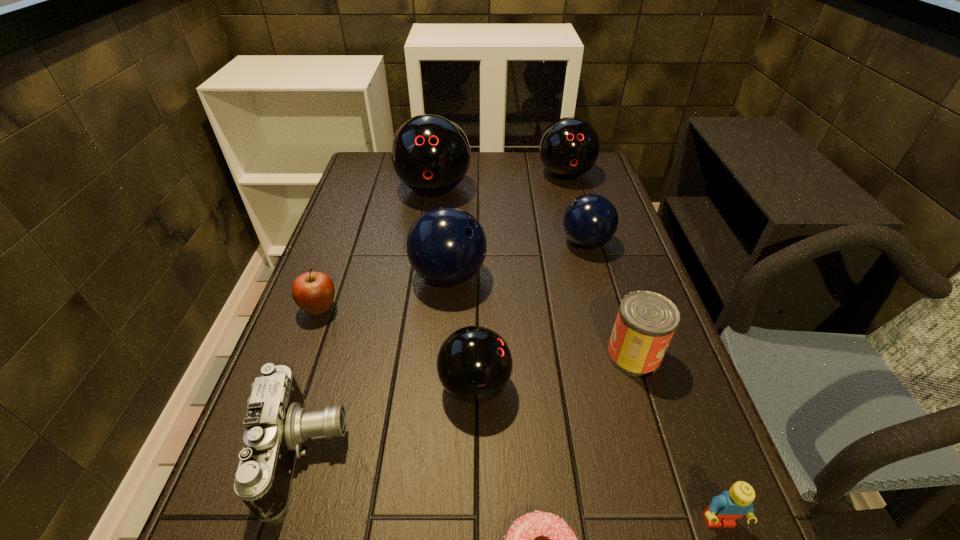
Locate an element on the screen. This screenshot has width=960, height=540. the tallest bowling ball is located at coordinates (430, 153).

This screenshot has width=960, height=540. I want to click on the tallest object, so click(x=430, y=153).

Where is `the rightmost black bowling ball`? This screenshot has width=960, height=540. the rightmost black bowling ball is located at coordinates (569, 147).

You are a GUI agent. You are given a task and a screenshot of the screen. Output one action in this format:
    pyautogui.click(x=<x>, y=<y>)
    Task: Click on the left blue bowling ball
    Image resolution: width=960 pixels, height=540 pixels.
    Given the screenshot: What is the action you would take?
    pyautogui.click(x=446, y=246)

At what (x,y) coordinates should I click in order to perform the action: click on the smaller blue bowling ball. Please return your answer as a coordinate pair (x, y). Looking at the image, I should click on (590, 221).

What are the coordinates of `the smallest black bowling ball` in the screenshot? It's located at (474, 364).

Where is `the nearest bowling ball`? Image resolution: width=960 pixels, height=540 pixels. the nearest bowling ball is located at coordinates (474, 364).

Image resolution: width=960 pixels, height=540 pixels. What are the coordinates of `can` in the screenshot? It's located at (646, 321).

This screenshot has height=540, width=960. I want to click on camera, so click(277, 423).

This screenshot has height=540, width=960. Identify the location of apple. (313, 292).